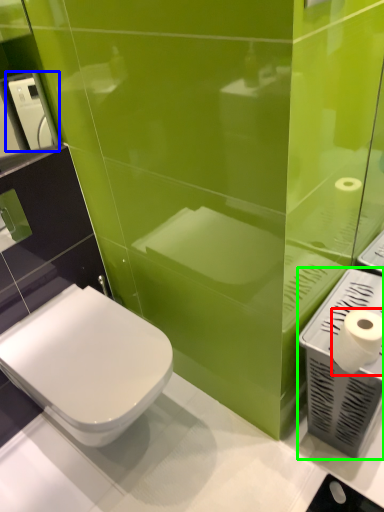
Question: Which object is the farthest from toilet paper (highlighted by a red box)? Choose among these: hand dryer (highlighted by a blue box) or hand dryer (highlighted by a green box).

Choices:
 (A) hand dryer
 (B) hand dryer

Answer: (A)